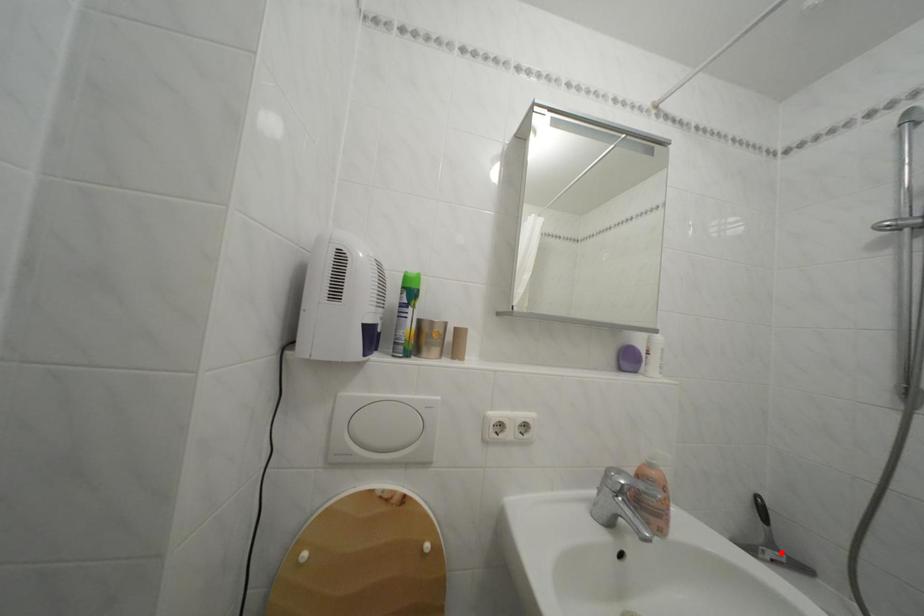
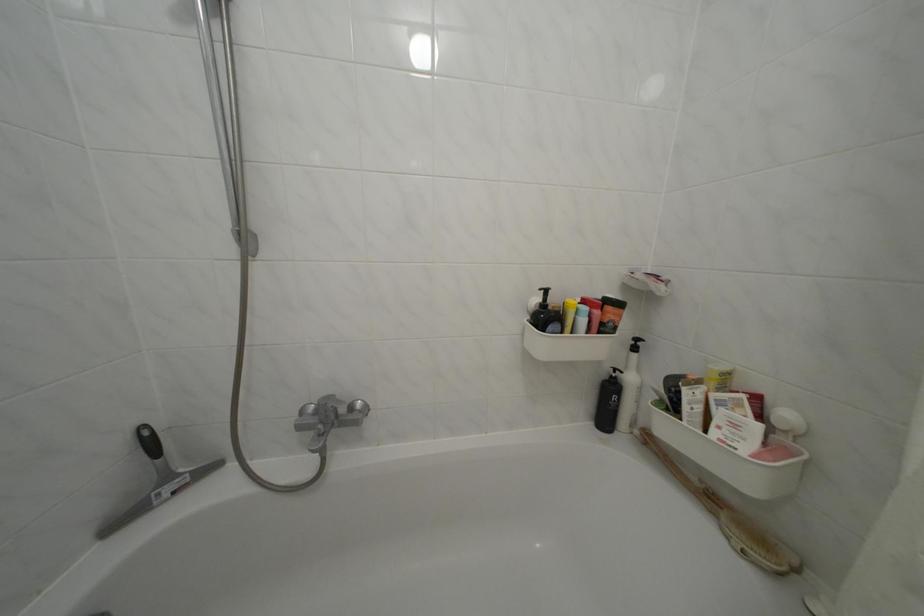
Find the pixel in the second image that matches the highlighted location in the first image.

(176, 484)